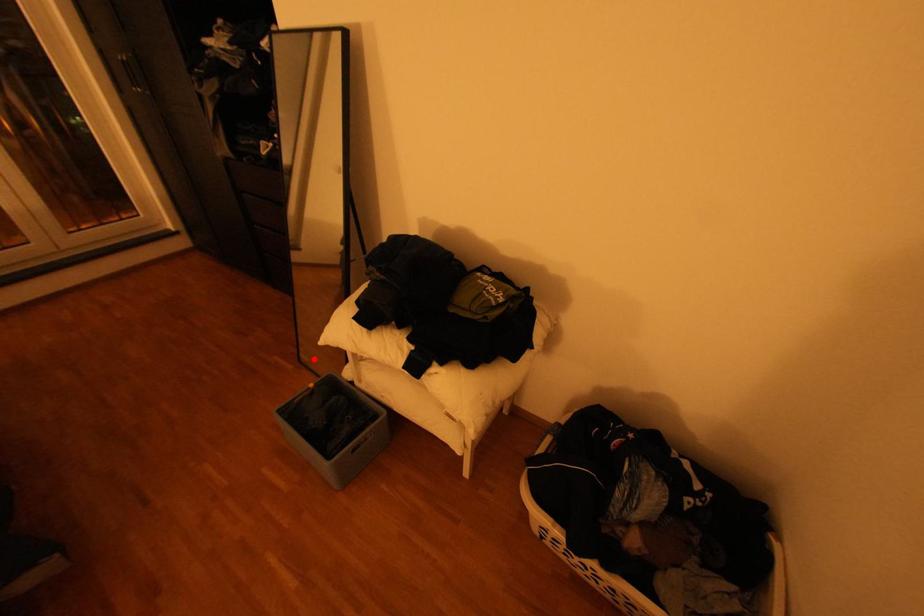
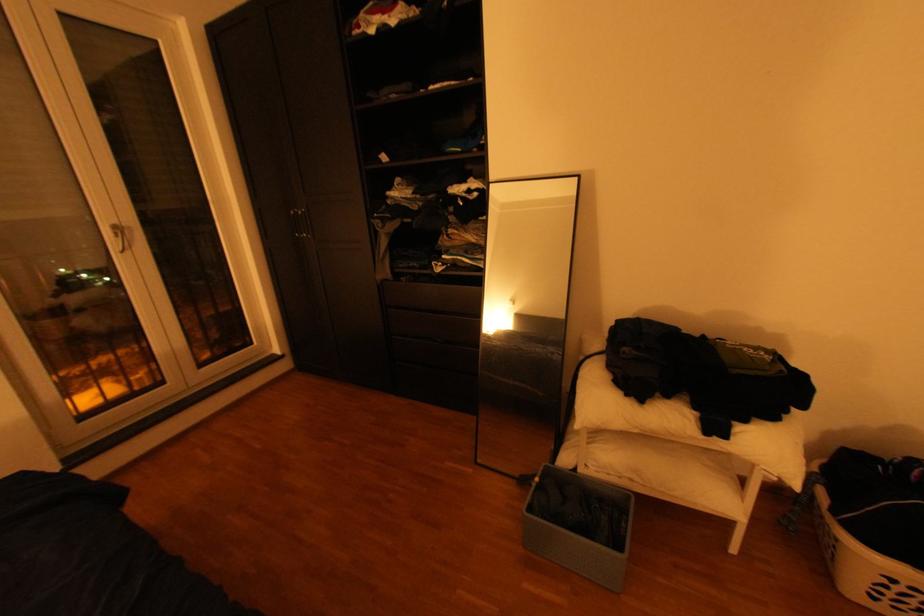
In the second image, find the point that corresponds to the highlighted location in the first image.

(488, 460)